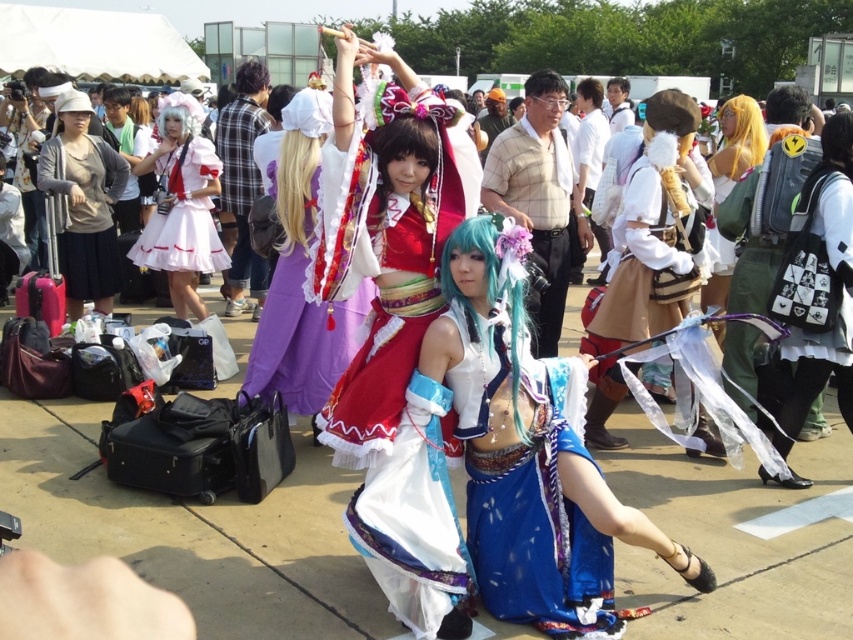
Is shiny red fabric dress at center below blue satin dress at center?

Actually, shiny red fabric dress at center is above blue satin dress at center.

Which is below, shiny red fabric dress at center or blue satin dress at center?

blue satin dress at center

The image size is (853, 640). Identify the location of shiny red fabric dress at center. (392, 328).

Is point (403, 156) closer to viewer compared to point (262, 364)?

That is True.

Where is `shiny red fabric dress at center`? The width and height of the screenshot is (853, 640). shiny red fabric dress at center is located at coordinates (392, 328).

The width and height of the screenshot is (853, 640). Find the location of `shiny red fabric dress at center`. shiny red fabric dress at center is located at coordinates (392, 328).

Which is more to the right, matte gray sweater at left or matte pink dress at left?

From the viewer's perspective, matte pink dress at left appears more on the right side.

Is matte gray sweater at left taller than matte pink dress at left?

Incorrect, matte gray sweater at left's height is not larger of matte pink dress at left's.

Who is more distant from viewer, (77, 100) or (155, 170)?

Result: Point (155, 170)

At what (x,y) coordinates should I click in order to perform the action: click on matte gray sweater at left. Please return your answer as a coordinate pair (x, y). The image size is (853, 640). Looking at the image, I should click on coord(83,204).